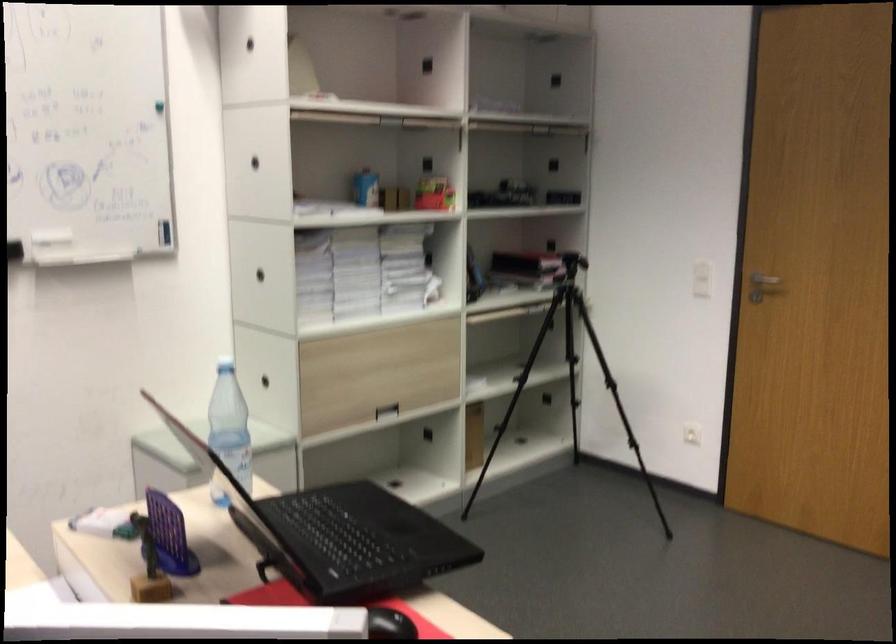
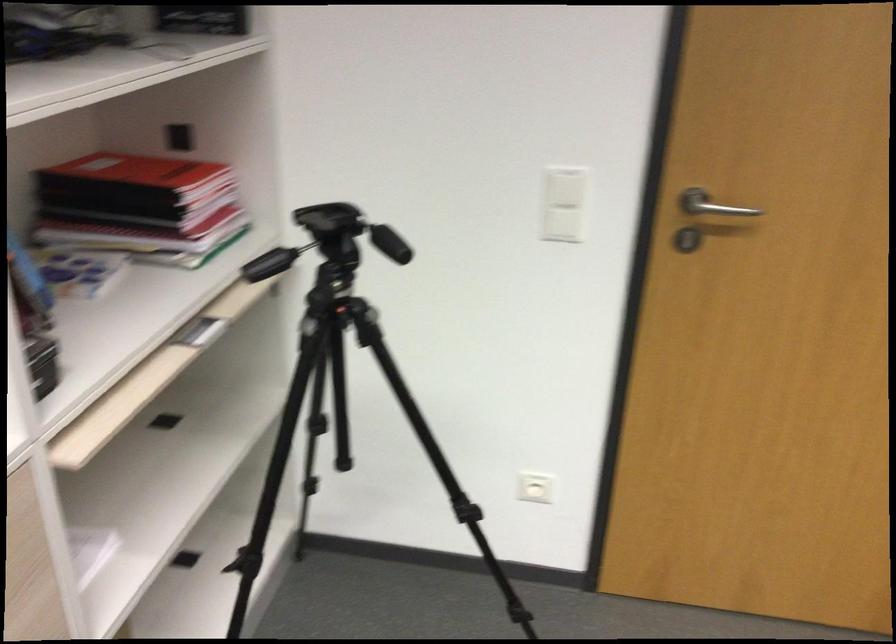
Find the pixel in the second image that matches point 716,285 in the first image.

(563, 225)